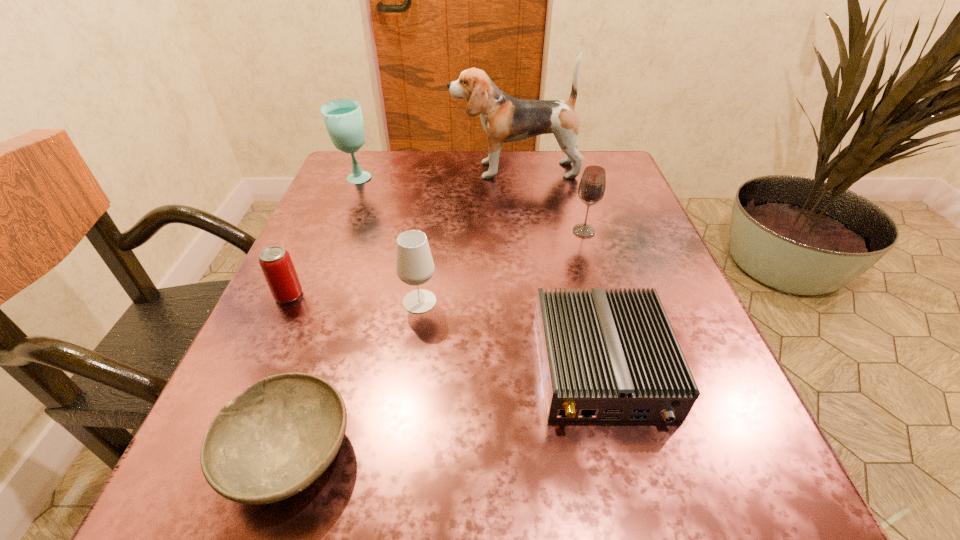
This screenshot has height=540, width=960. What are the coordinates of `vacant region that satisfies the following two spatial constraints: 1. at the face of the third farthest object; 2. on the left side of the tallest object` in the screenshot? It's located at (521, 231).